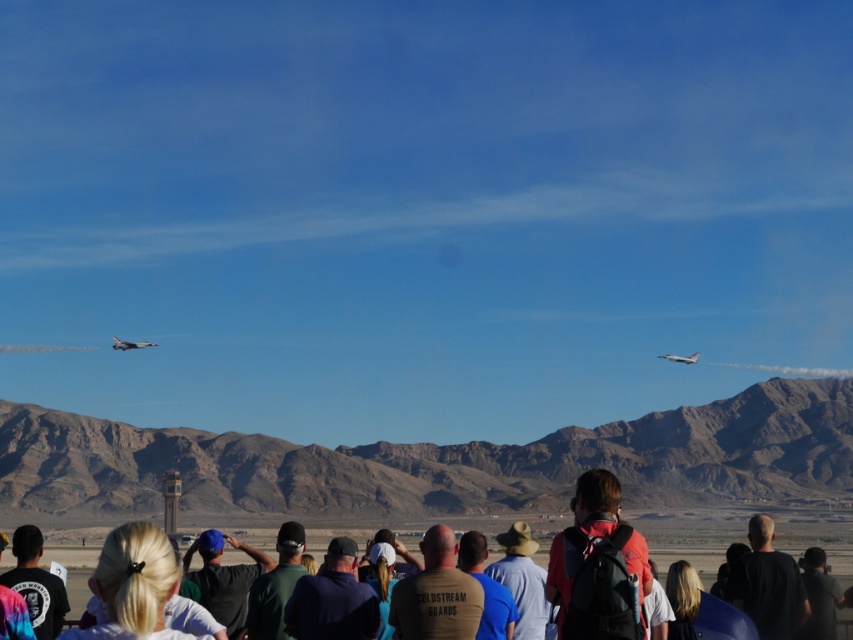
You are a photographer at the airshow trying to capture a photo of the jets. You notice the desert brown rock formation at center and the dark brown shirt at center in your frame. Which object should you focus on to ensure it appears larger in your photo?

The desert brown rock formation at center should be focused on because it has a greater height compared to the dark brown shirt at center, making it appear larger in the photo.

You are a photographer at the airshow trying to capture a photo of the jets. You notice the desert brown rock formation at center and the black matte shirt at lower right in your frame. Which object would appear larger in your photo?

The desert brown rock formation at center would appear larger in the photo because it is much taller than the black matte shirt at lower right.

You are standing at the position of the camera and looking at the two points in the scene, point (28, 481) and point (759, 552). Which point is closer to you?

Point (28, 481) is closer to you because it is further to the camera than point (759, 552).